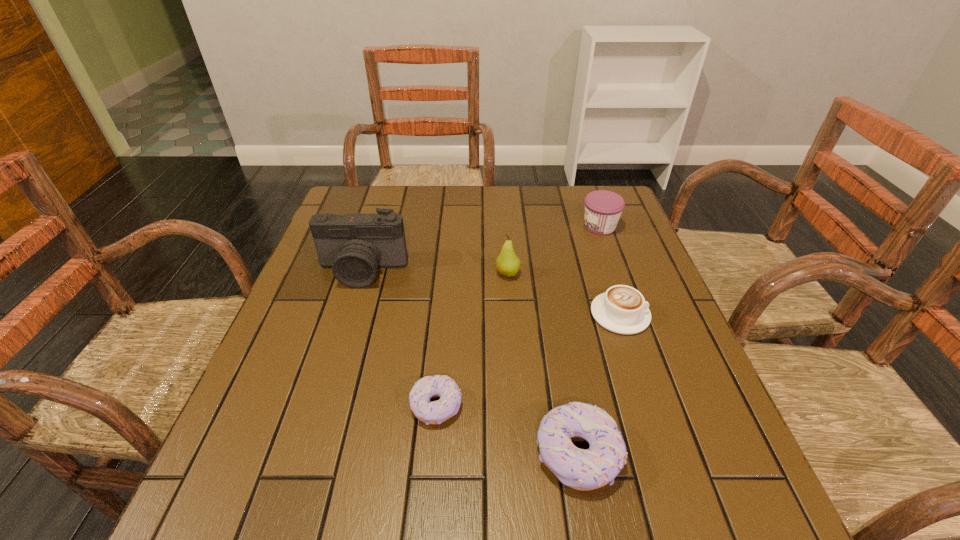
I want to click on vacant space located 0.160m on the left of the second object from left to right, so click(325, 406).

You are a GUI agent. You are given a task and a screenshot of the screen. Output one action in this format:
    pyautogui.click(x=<x>, y=<y>)
    Task: Click on the free space located on the back of the taller doughnut
    
    Given the screenshot: What is the action you would take?
    pyautogui.click(x=546, y=276)

Locate an element on the screen. vacant space located 0.350m on the front label of the farthest object is located at coordinates pos(461,226).

Where is `vacant space situated 0.350m on the front label of the farthest object`? This screenshot has height=540, width=960. vacant space situated 0.350m on the front label of the farthest object is located at coordinates (461, 226).

I want to click on vacant space located on the front label of the farthest object, so click(549, 226).

Find the location of `free space located at the lens of the camera`. free space located at the lens of the camera is located at coordinates (322, 402).

This screenshot has height=540, width=960. I want to click on free point located 0.310m on the left of the second tallest object, so click(374, 274).

I want to click on blank space located with the handle on the right side of the cappuccino, so click(x=671, y=314).

The image size is (960, 540). In order to click on object at the far edge in this screenshot , I will do `click(603, 208)`.

Locate an element on the screen. object that is at the left edge is located at coordinates (354, 245).